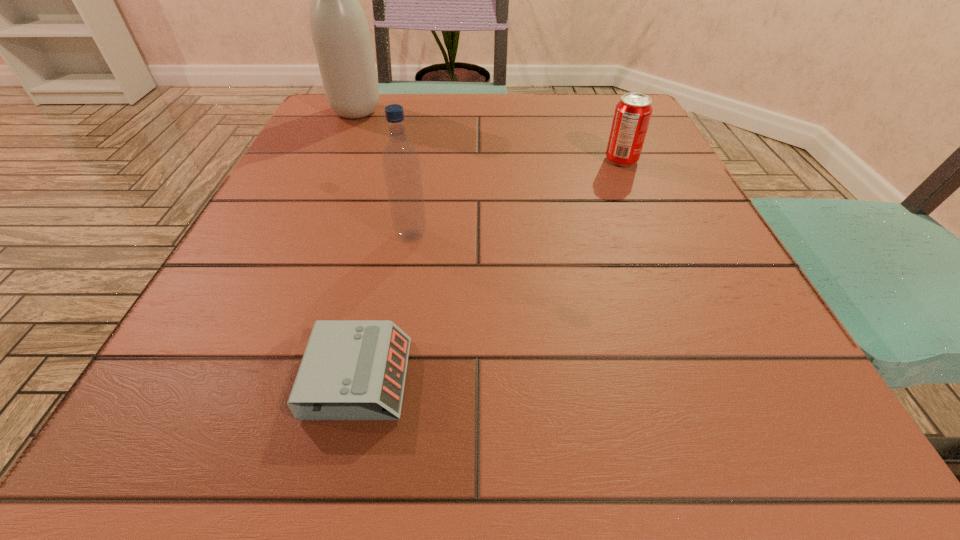
You are a GUI agent. You are given a task and a screenshot of the screen. Output one action in this format:
    pyautogui.click(x=<x>, y=<y>)
    Task: Click on the vacant space located 0.180m on the front of the soda
    The width and height of the screenshot is (960, 540).
    Given the screenshot: What is the action you would take?
    pyautogui.click(x=651, y=228)

The image size is (960, 540). Find the location of `vacant space located on the back of the nearest object`. vacant space located on the back of the nearest object is located at coordinates (395, 216).

Identify the location of object located in the far edge section of the desktop. The height and width of the screenshot is (540, 960). (340, 33).

Where is `object that is at the near edge`? Image resolution: width=960 pixels, height=540 pixels. object that is at the near edge is located at coordinates (351, 369).

The image size is (960, 540). I want to click on object that is at the left edge, so click(340, 33).

At what (x,y) coordinates should I click in order to perform the action: click on object that is at the right edge. Please return your answer as a coordinate pair (x, y). This screenshot has height=540, width=960. Looking at the image, I should click on (633, 112).

Locate an element on the screen. This screenshot has width=960, height=540. object present at the far left corner is located at coordinates (340, 33).

You are a GUI agent. You are given a task and a screenshot of the screen. Output one action in this format:
    pyautogui.click(x=<x>, y=<y>)
    Task: Click on the vacant space at the far edge of the desktop
    The image size is (960, 540).
    Given the screenshot: What is the action you would take?
    pyautogui.click(x=544, y=108)

Where is `vacant space at the near edge of the desktop`? vacant space at the near edge of the desktop is located at coordinates (660, 411).

At what (x,y) coordinates should I click in order to perform the action: click on vacant space at the left edge of the desktop. Please return your answer as a coordinate pair (x, y). The image size is (960, 540). Looking at the image, I should click on (226, 295).